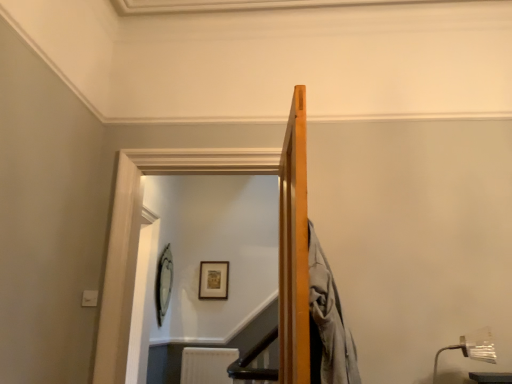
Question: From their relative heights in the image, would you say clear glass door at upper center is taller or shorter than metallic silver lamp at lower right?

Choices:
 (A) short
 (B) tall

Answer: (B)

Question: From a real-world perspective, is clear glass door at upper center above or below metallic silver lamp at lower right?

Choices:
 (A) above
 (B) below

Answer: (A)

Question: Estimate the real-world distances between objects in this image. Which object is farther from the wooden picture frame at upper center, which ranks as the 2th picture frame in left-to-right order?

Choices:
 (A) metallic silver lamp at lower right
 (B) white textured radiator at lower center
 (C) silver metallic picture frame at upper center, which is the second picture frame from right to left
 (D) clear glass door at upper center

Answer: (A)

Question: Based on their relative distances, which object is nearer to the clear glass door at upper center?

Choices:
 (A) metallic silver lamp at lower right
 (B) silver metallic picture frame at upper center, which is the second picture frame from right to left
 (C) white textured radiator at lower center
 (D) wooden picture frame at upper center, which is counted as the 1th picture frame, starting from the right

Answer: (B)